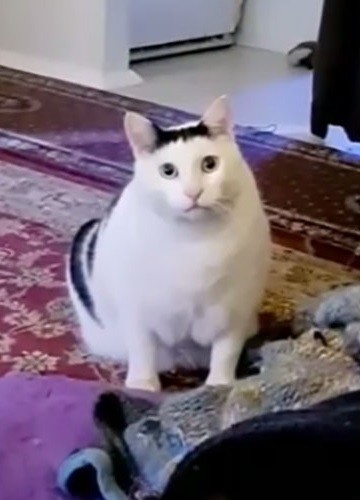
The width and height of the screenshot is (360, 500). Identify the location of white fur. (205, 256).